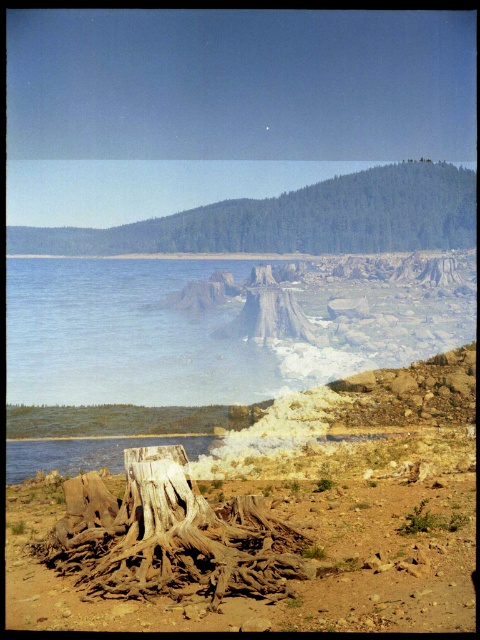
Between light brown wood at center and brown textured tree stump at center, which one appears on the left side from the viewer's perspective?

Positioned to the left is brown textured tree stump at center.

Does light brown wood at center have a lesser height compared to brown textured tree stump at center?

Indeed, light brown wood at center has a lesser height compared to brown textured tree stump at center.

Who is more forward, (87, 528) or (458, 168)?

Point (87, 528) is in front.

At what (x,y) coordinates should I click in order to perform the action: click on light brown wood at center. Please return your answer as a coordinate pair (x, y). Looking at the image, I should click on (169, 536).

Is point (277, 618) positioned after point (187, 504)?

No, (277, 618) is closer to viewer.

In the scene shown: Between brown rough tree roots at lower center and light brown wood at center, which one appears on the left side from the viewer's perspective?

Positioned to the left is brown rough tree roots at lower center.

Is point (210, 618) positioned behind point (204, 582)?

No.

This screenshot has height=640, width=480. In order to click on brown rough tree roots at lower center in this screenshot , I will do pyautogui.click(x=292, y=582).

Between brown rough tree roots at lower center and brown textured tree stump at center, which one is positioned higher?

brown textured tree stump at center is above.

Can you confirm if brown rough tree roots at lower center is smaller than brown textured tree stump at center?

Yes.

Describe the element at coordinates (292, 582) in the screenshot. The image size is (480, 640). I see `brown rough tree roots at lower center` at that location.

Where is `brown rough tree roots at lower center`? This screenshot has height=640, width=480. brown rough tree roots at lower center is located at coordinates (292, 582).